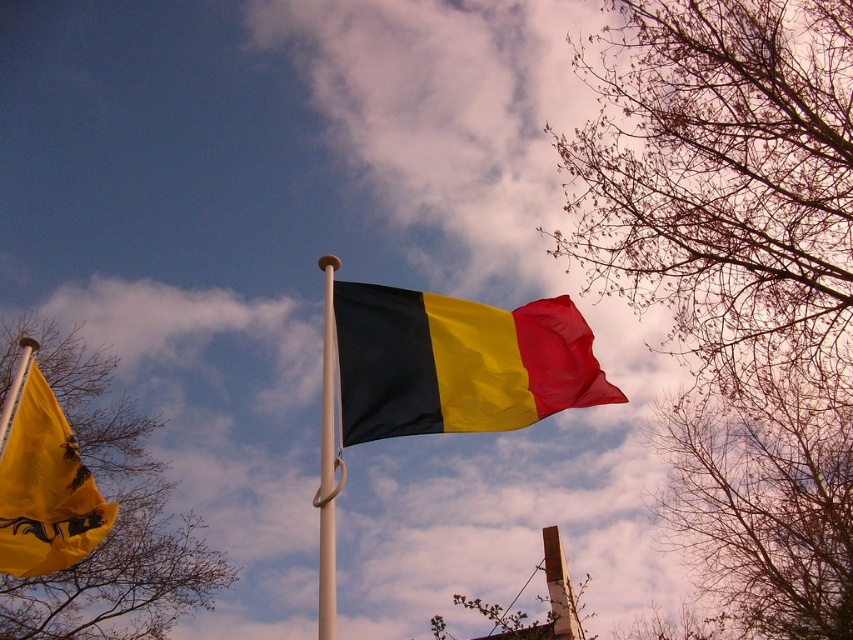
In the scene shown: You are standing in front of the Belgian flag and notice a point marked at coordinates (737, 276). Based on the scene description, what object is located at that point?

The point at coordinates (737, 276) indicates bare branches at upper right.

You are an artist sketching the scene. You need to decide which object to draw first based on their widths. Which is wider, the bare branches at upper right or the black matte flag at center?

The bare branches at upper right are wider than the black matte flag at center according to the description.

You are an observer looking at the scene with the Belgian flag and the other flag. You notice two sets of bare branches in the frame. Which of the two, the bare branches at upper right or the bare branches at left, extends higher into the sky?

The bare branches at upper right extends higher into the sky than the bare branches at left because it has a greater height compared to them.